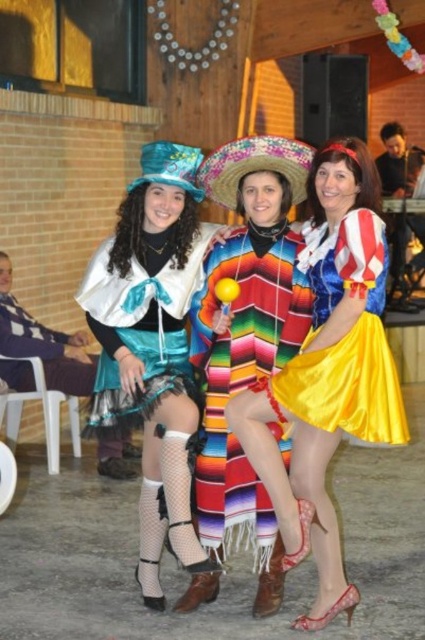
Question: Observing the image, what is the correct spatial positioning of shiny teal fabric dress at left in reference to multicolored woven poncho at center?

Choices:
 (A) below
 (B) above

Answer: (B)

Question: Which object appears closest to the camera in this image?

Choices:
 (A) shiny teal cape at center
 (B) shiny satin skirt at center

Answer: (B)

Question: Which of the following is the farthest from the observer?

Choices:
 (A) (201, 268)
 (B) (280, 260)
 (C) (325, 289)

Answer: (A)

Question: Is shiny teal fabric dress at left wider than multicolored woven poncho at center?

Choices:
 (A) no
 (B) yes

Answer: (B)

Question: Is shiny satin skirt at center to the right of shiny teal fabric dress at left from the viewer's perspective?

Choices:
 (A) yes
 (B) no

Answer: (A)

Question: Which point is farther from the camera taking this photo?

Choices:
 (A) (365, 372)
 (B) (149, 177)
 (C) (226, 376)
 (D) (359, 257)

Answer: (C)